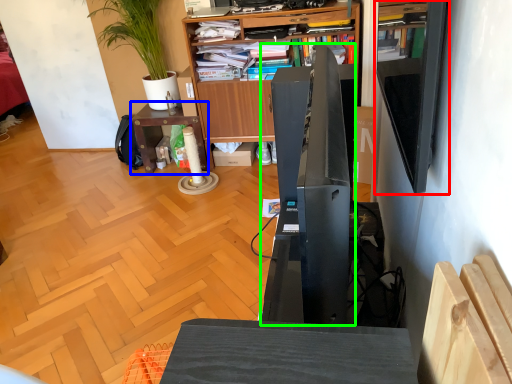
Question: Considering the real-world distances, which object is farthest from shelf (highlighted by a red box)? table (highlighted by a blue box) or appliance (highlighted by a green box)?

Choices:
 (A) table
 (B) appliance

Answer: (A)